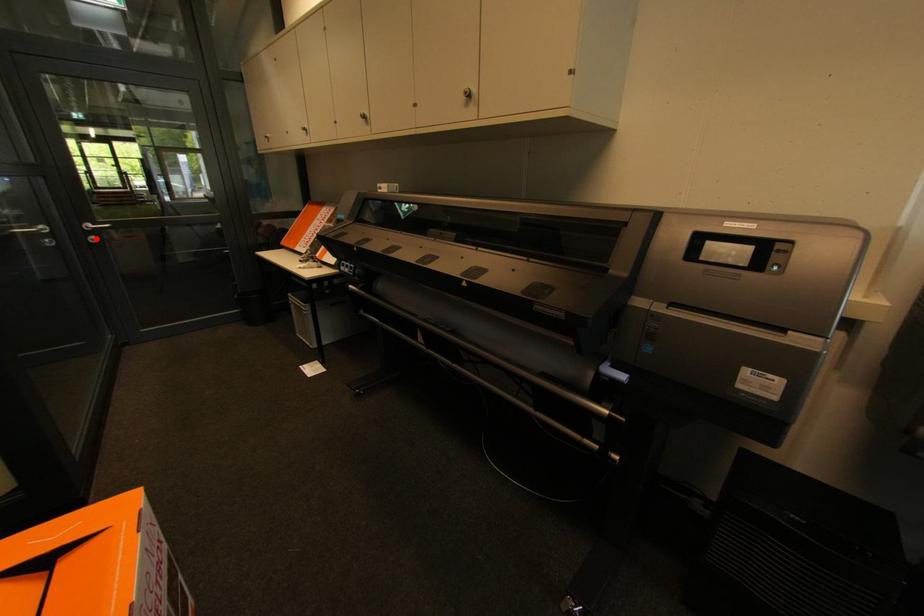
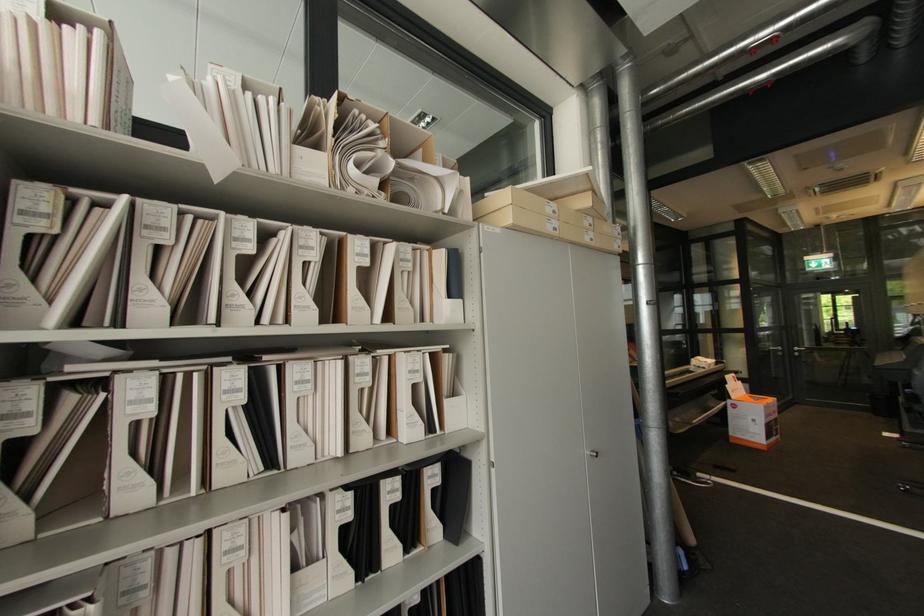
The point at the highlighted location is marked in the first image. Where is the corresponding point in the second image?

(800, 354)